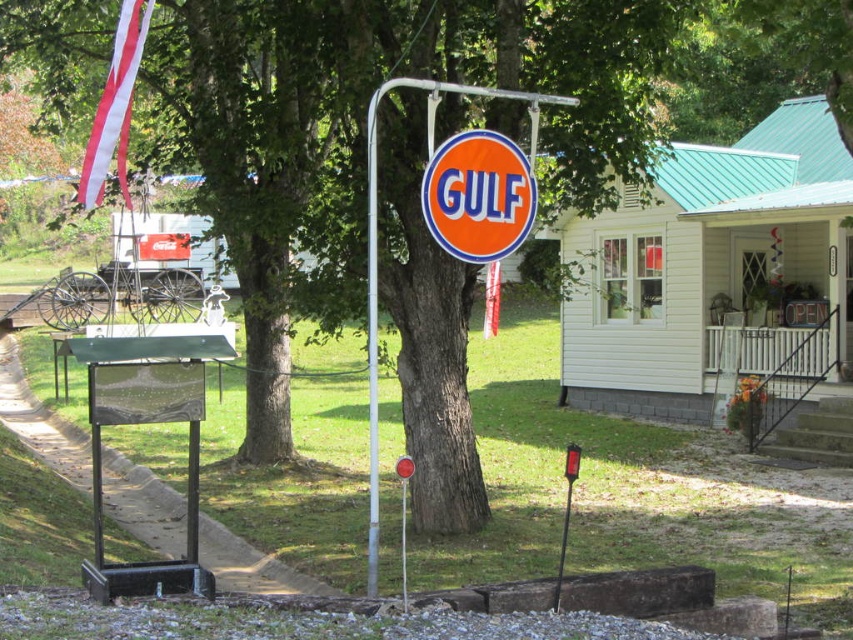
You are a maintenance worker inspecting the Gulf gas station sign. You notice the orange glossy sign at center and the metallic pole at center. Which object is located above the other?

The orange glossy sign at center is positioned over the metallic pole at center, meaning it is above the metallic pole at center.

Consider the image. You are a painter who needs to know the relative sizes of the orange glossy sign at center and the metallic pole at center for your artwork. Which object is wider?

The orange glossy sign at center is wider than the metallic pole at center according to the description.

You are standing at point (143, 422) in the image. What object is located at this point?

The green glossy sign at lower left is located at point (143, 422).